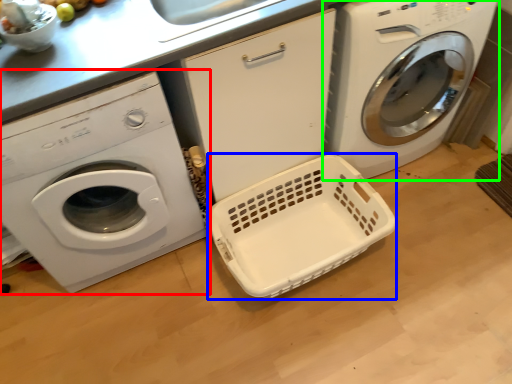
Question: Which object is the closest to the washing machine (highlighted by a red box)? Choose among these: basket container (highlighted by a blue box) or washing machine (highlighted by a green box).

Choices:
 (A) basket container
 (B) washing machine

Answer: (A)